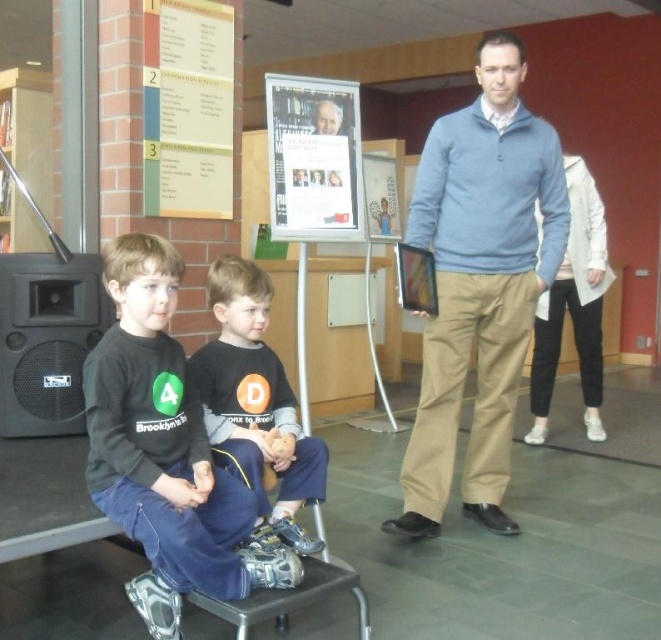
Is blue sweater at center taller than black cotton shirt at lower left?

Yes, blue sweater at center is taller than black cotton shirt at lower left.

Does point (508, 289) lie in front of point (165, 426)?

No, (508, 289) is further to viewer.

The image size is (661, 640). I want to click on blue sweater at center, so click(x=479, y=284).

Is yellow paper at upper left shorter than smooth skin face at upper center?

No, yellow paper at upper left is not shorter than smooth skin face at upper center.

Identify the location of yellow paper at upper left. (188, 109).

Image resolution: width=661 pixels, height=640 pixels. I want to click on yellow paper at upper left, so click(188, 109).

Is black cotton shirt at lower left below smooth skin face at upper center?

Indeed, black cotton shirt at lower left is positioned under smooth skin face at upper center.

Is black cotton shirt at lower left taller than smooth skin face at upper center?

Indeed, black cotton shirt at lower left has a greater height compared to smooth skin face at upper center.

The height and width of the screenshot is (640, 661). What do you see at coordinates (165, 451) in the screenshot?
I see `black cotton shirt at lower left` at bounding box center [165, 451].

Where is `black cotton shirt at lower left`? black cotton shirt at lower left is located at coordinates (165, 451).